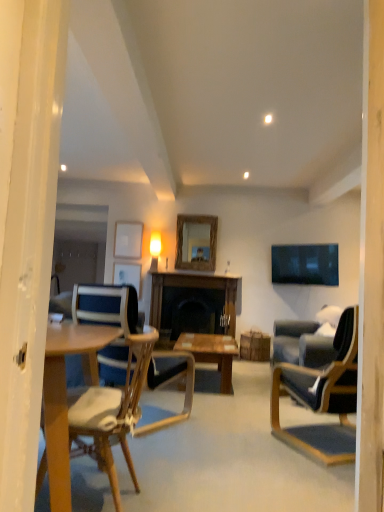
Identify the location of vacant area situated to the left side of dark gray fabric chair at right, placed as the 2th chair when sorted from left to right. The height and width of the screenshot is (512, 384). 238,447.